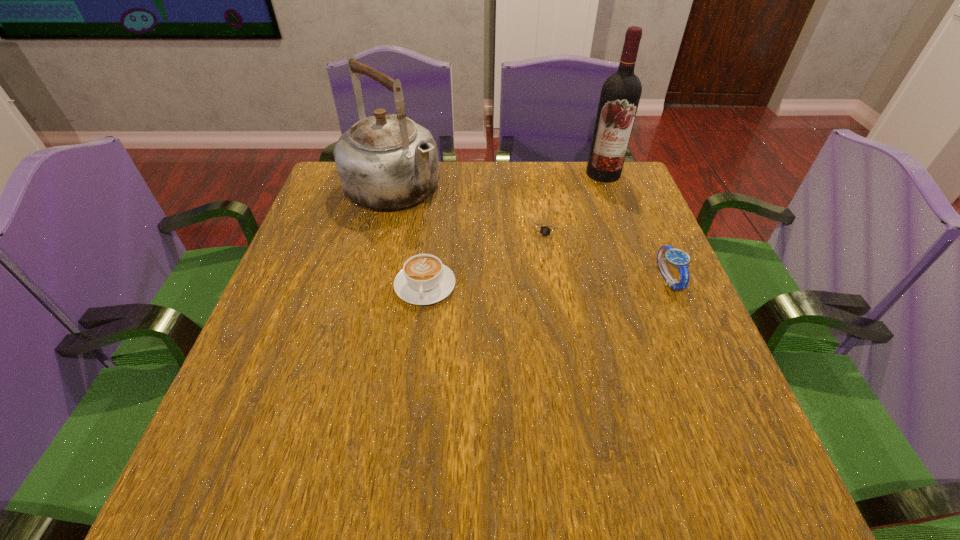
Select which object appears as the second closest to the kettle. Please provide its 2D coordinates. Your answer should be formatted as a tuple, i.e. [(x, y)], where the tuple contains the x and y coordinates of a point satisfying the conditions above.

[(548, 231)]

The image size is (960, 540). I want to click on blank space that satisfies the following two spatial constraints: 1. on the back side of the shorter watch; 2. on the right side of the tallest object, so click(539, 174).